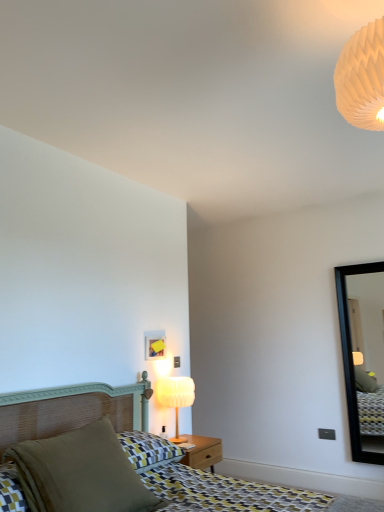
Question: From the image's perspective, would you say matte white lamp at center is shown under matte green pillow at lower left?

Choices:
 (A) yes
 (B) no

Answer: (A)

Question: Is matte white lamp at center facing towards matte green pillow at lower left?

Choices:
 (A) yes
 (B) no

Answer: (B)

Question: From a real-world perspective, is matte white lamp at center over matte green pillow at lower left?

Choices:
 (A) yes
 (B) no

Answer: (A)

Question: Is matte white lamp at center behind matte green pillow at lower left?

Choices:
 (A) no
 (B) yes

Answer: (B)

Question: Can we say matte white lamp at center lies outside matte green pillow at lower left?

Choices:
 (A) no
 (B) yes

Answer: (B)

Question: Visually, is matte wicker bed at lower left positioned to the left or to the right of matte green pillow at lower left?

Choices:
 (A) right
 (B) left

Answer: (A)

Question: From the image's perspective, is matte wicker bed at lower left located above or below matte green pillow at lower left?

Choices:
 (A) above
 (B) below

Answer: (B)

Question: From a real-world perspective, is matte wicker bed at lower left above or below matte green pillow at lower left?

Choices:
 (A) below
 (B) above

Answer: (A)

Question: Would you say matte wicker bed at lower left is inside or outside matte green pillow at lower left?

Choices:
 (A) outside
 (B) inside

Answer: (A)

Question: Is matte yellow picture frame at center bigger or smaller than black frame mirror at right?

Choices:
 (A) small
 (B) big

Answer: (A)

Question: Considering the positions of matte yellow picture frame at center and black frame mirror at right in the image, is matte yellow picture frame at center wider or thinner than black frame mirror at right?

Choices:
 (A) wide
 (B) thin

Answer: (B)

Question: Is matte yellow picture frame at center inside or outside of black frame mirror at right?

Choices:
 (A) outside
 (B) inside

Answer: (A)

Question: Is matte yellow picture frame at center to the left or to the right of black frame mirror at right in the image?

Choices:
 (A) right
 (B) left

Answer: (B)

Question: From a real-world perspective, is black frame mirror at right positioned above or below matte green pillow at lower left?

Choices:
 (A) above
 (B) below

Answer: (A)

Question: Considering the relative positions of black frame mirror at right and matte green pillow at lower left in the image provided, is black frame mirror at right to the left or to the right of matte green pillow at lower left?

Choices:
 (A) left
 (B) right

Answer: (B)